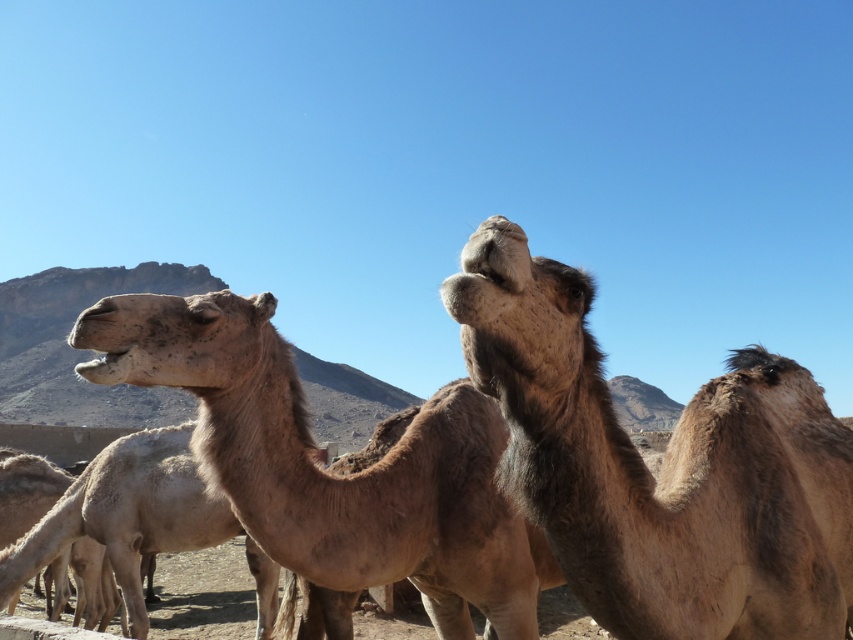
Is point (567, 308) farther from viewer compared to point (126, 310)?

No.

Who is more forward, (695, 566) or (486, 515)?

Positioned in front is point (695, 566).

Locate an element on the screen. brown fuzzy camel at center is located at coordinates (662, 465).

Is brown textured camel at center to the left of fuzzy brown camel at center from the viewer's perspective?

In fact, brown textured camel at center is to the right of fuzzy brown camel at center.

Can you confirm if brown textured camel at center is bigger than fuzzy brown camel at center?

Incorrect, brown textured camel at center is not larger than fuzzy brown camel at center.

You are a GUI agent. You are given a task and a screenshot of the screen. Output one action in this format:
    pyautogui.click(x=<x>, y=<y>)
    Task: Click on the brown textured camel at center
    
    Given the screenshot: What is the action you would take?
    pyautogui.click(x=331, y=474)

Which is behind, point (585, 545) or point (32, 547)?

Point (32, 547)

Who is higher up, brown fuzzy camel at center or fuzzy brown camel at center?

brown fuzzy camel at center is higher up.

Identify the location of brown fuzzy camel at center. (662, 465).

Locate an element on the screen. This screenshot has width=853, height=640. brown fuzzy camel at center is located at coordinates (662, 465).